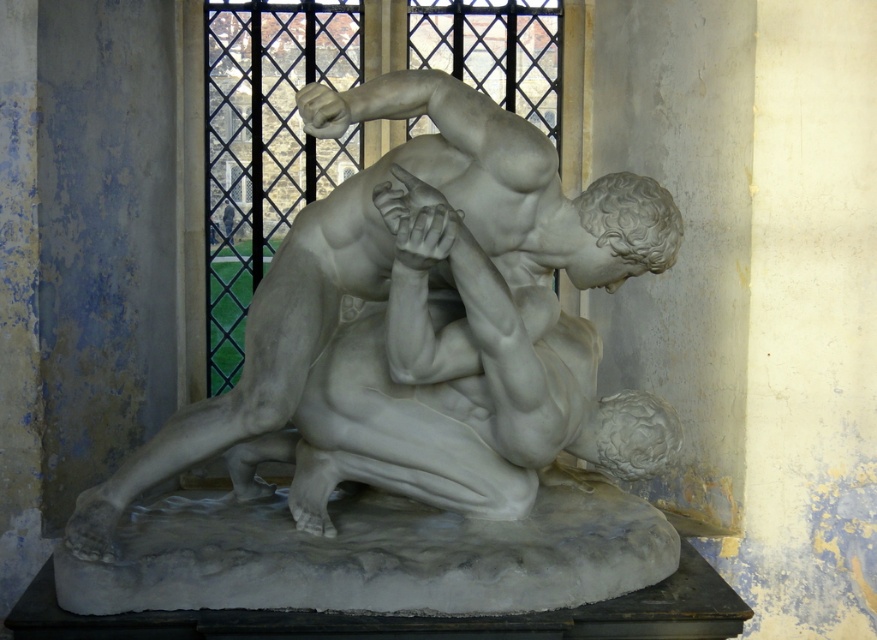
Question: Can you confirm if white marble statue at center is positioned above clear glass window at center?

Choices:
 (A) yes
 (B) no

Answer: (B)

Question: Which object appears closest to the camera in this image?

Choices:
 (A) clear glass window at center
 (B) white marble base at lower center

Answer: (B)

Question: Among these objects, which one is farthest from the camera?

Choices:
 (A) white marble base at lower center
 (B) clear glass window at center

Answer: (B)

Question: Which object is farther from the camera taking this photo?

Choices:
 (A) white marble base at lower center
 (B) clear glass window at center

Answer: (B)

Question: Does white marble statue at center appear on the left side of white marble base at lower center?

Choices:
 (A) no
 (B) yes

Answer: (B)

Question: Is white marble base at lower center wider than clear glass window at center?

Choices:
 (A) no
 (B) yes

Answer: (B)